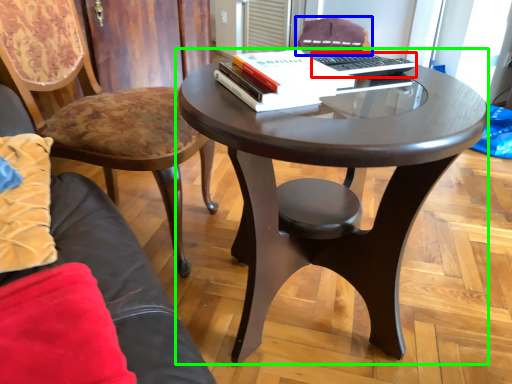
Question: Estimate the real-world distances between objects in this image. Which object is closer to laptop keyboard (highlighted by a red box), chair (highlighted by a blue box) or coffee table (highlighted by a green box)?

Choices:
 (A) chair
 (B) coffee table

Answer: (B)